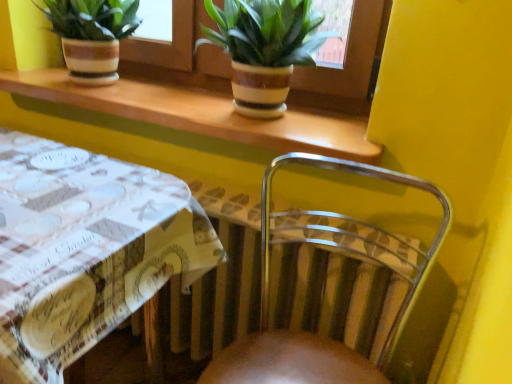
This screenshot has height=384, width=512. I want to click on free point below green leafy plant in striped pot at upper center, the first houseplant positioned from the right (from a real-world perspective), so click(x=250, y=119).